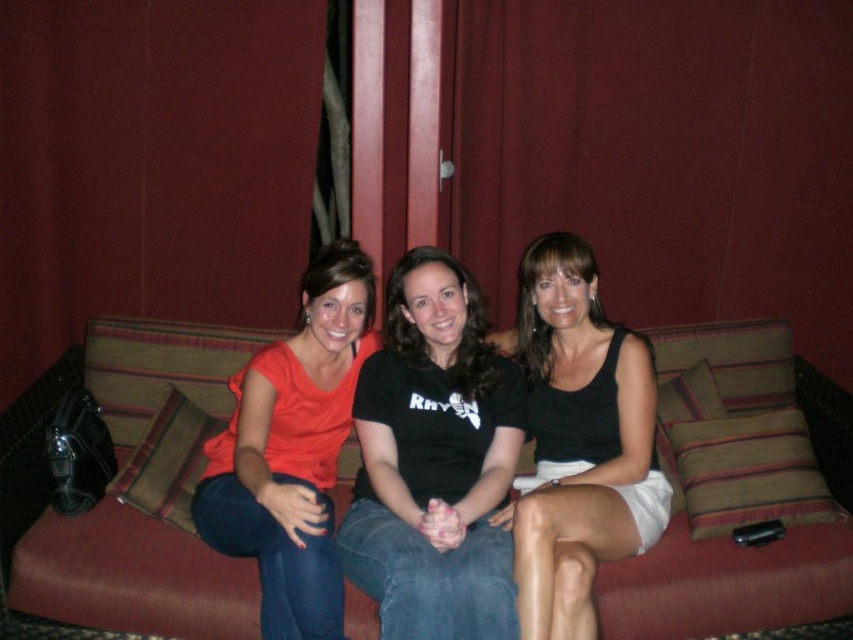
Question: Is black matte t-shirt at center below black matte tank top at center?

Choices:
 (A) no
 (B) yes

Answer: (A)

Question: Does textured fabric couch at center appear on the left side of matte orange shirt at center?

Choices:
 (A) yes
 (B) no

Answer: (B)

Question: Which of these objects is positioned farthest from the black matte t-shirt at center?

Choices:
 (A) black matte tank top at center
 (B) textured fabric couch at center
 (C) matte orange shirt at center

Answer: (B)

Question: Among these objects, which one is farthest from the camera?

Choices:
 (A) matte orange shirt at center
 (B) textured fabric couch at center
 (C) black matte tank top at center

Answer: (B)

Question: Which of the following is the closest to the observer?

Choices:
 (A) (614, 624)
 (B) (332, 356)
 (C) (374, 435)
 (D) (631, 444)

Answer: (A)

Question: Is black matte t-shirt at center wider than black matte tank top at center?

Choices:
 (A) no
 (B) yes

Answer: (A)